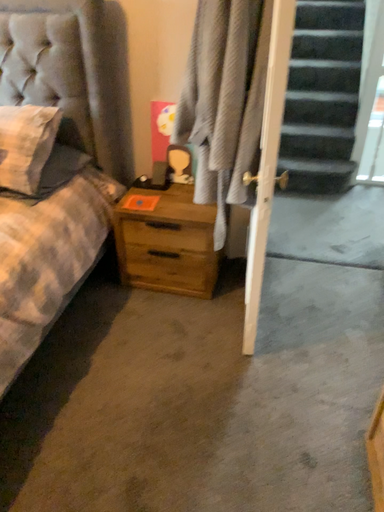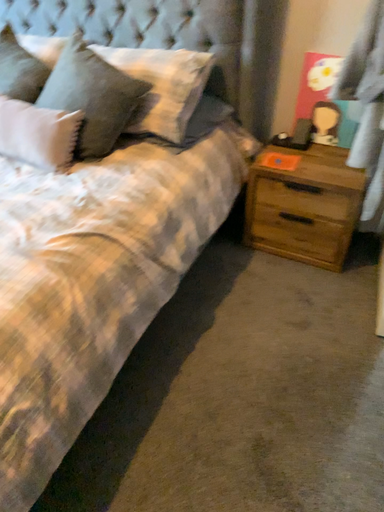
Question: Which way did the camera rotate in the video?

Choices:
 (A) rotated left
 (B) rotated right

Answer: (A)